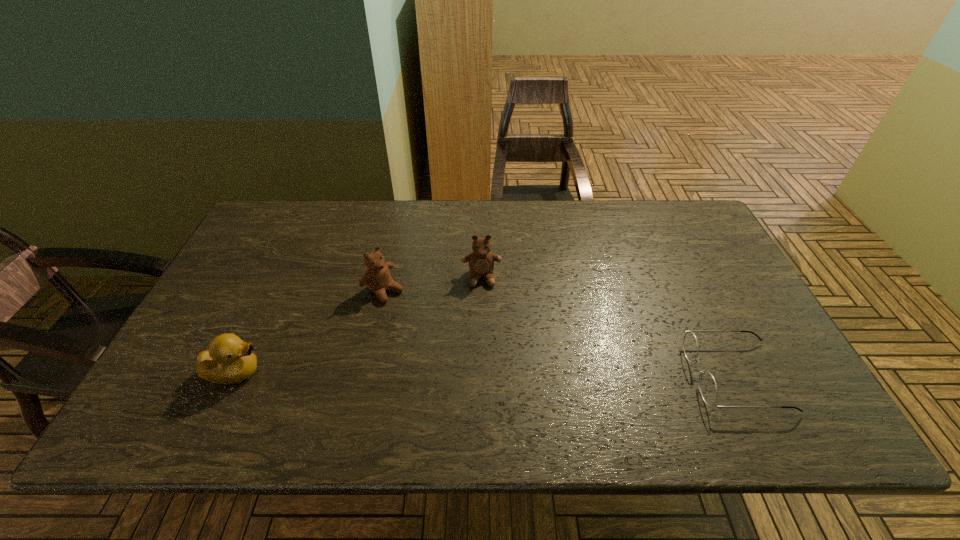
Find the location of a particular element. The height and width of the screenshot is (540, 960). vacant spot on the desktop that is between the leftmost object and the spectacles and is positioned on the face of the left teddy bear is located at coordinates (491, 374).

What are the coordinates of `free spot on the desktop that is between the leftmost object and the rightmost object and is positioned on the front-facing side of the right teddy bear` in the screenshot? It's located at (486, 374).